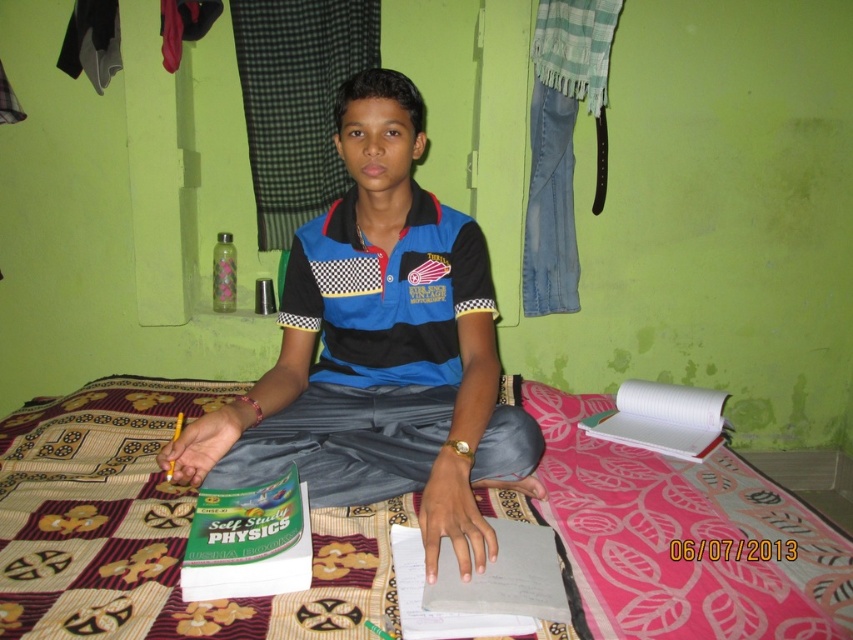
Question: Which object is closer to the camera taking this photo?

Choices:
 (A) blue checkered polo shirt at center
 (B) patterned fabric bed at center
 (C) blue cotton shirt at center

Answer: (B)

Question: Is patterned fabric bed at center behind blue cotton shirt at center?

Choices:
 (A) no
 (B) yes

Answer: (A)

Question: Can you confirm if blue cotton shirt at center is wider than blue checkered polo shirt at center?

Choices:
 (A) yes
 (B) no

Answer: (A)

Question: Which object is positioned closest to the blue checkered polo shirt at center?

Choices:
 (A) blue cotton shirt at center
 (B) patterned fabric bed at center

Answer: (A)

Question: Does blue cotton shirt at center lie in front of blue checkered polo shirt at center?

Choices:
 (A) yes
 (B) no

Answer: (A)

Question: Which point is farther from the camera taking this photo?

Choices:
 (A) (200, 444)
 (B) (764, 573)
 (C) (335, 342)

Answer: (C)